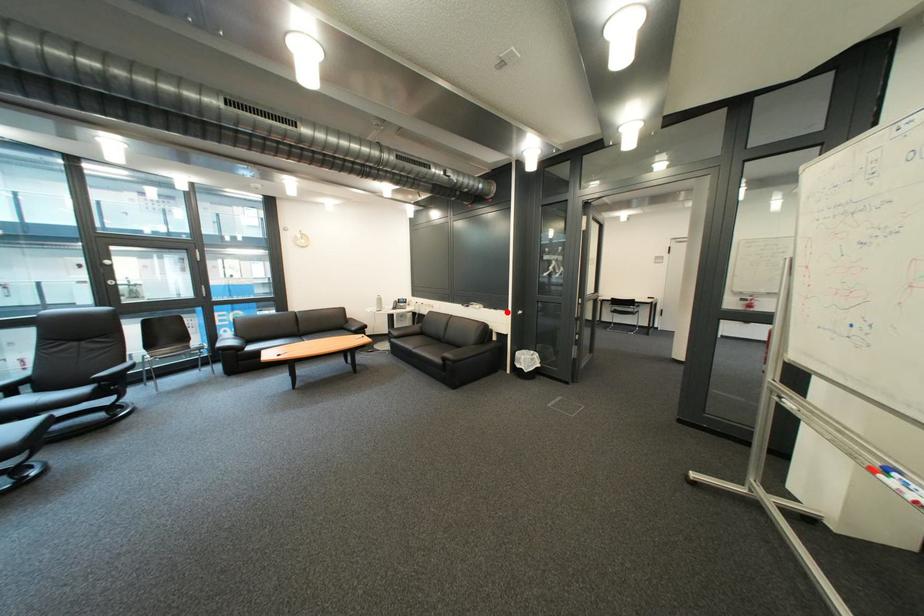
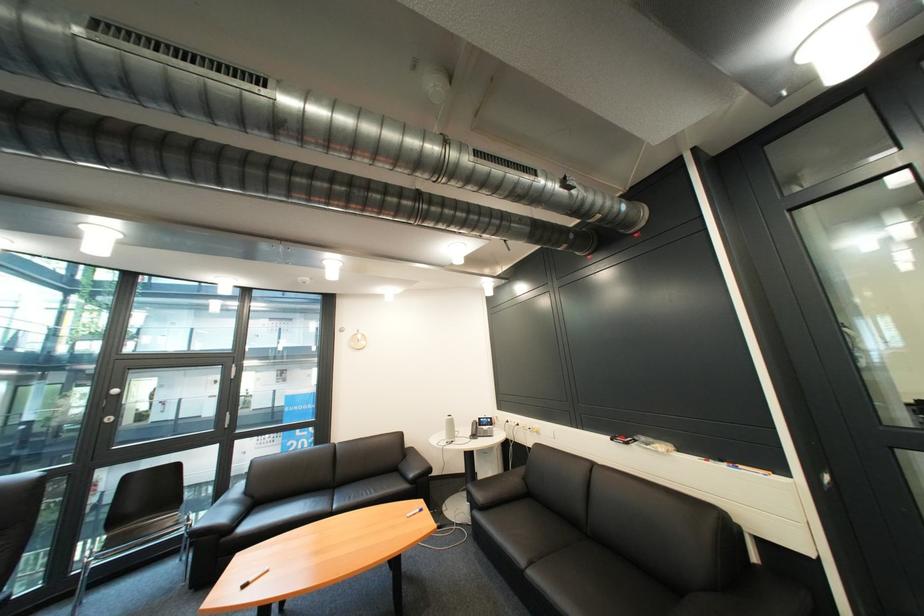
The point at the highlighted location is marked in the first image. Where is the corresponding point in the second image?

(736, 468)